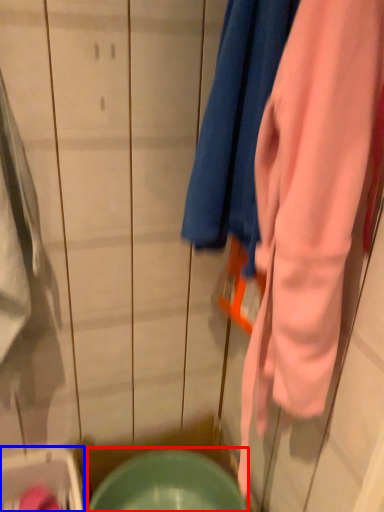
Question: Which of the following is the closest to the observer, mixing bowl (highlighted by a red box) or washer (highlighted by a blue box)?

Choices:
 (A) mixing bowl
 (B) washer

Answer: (B)